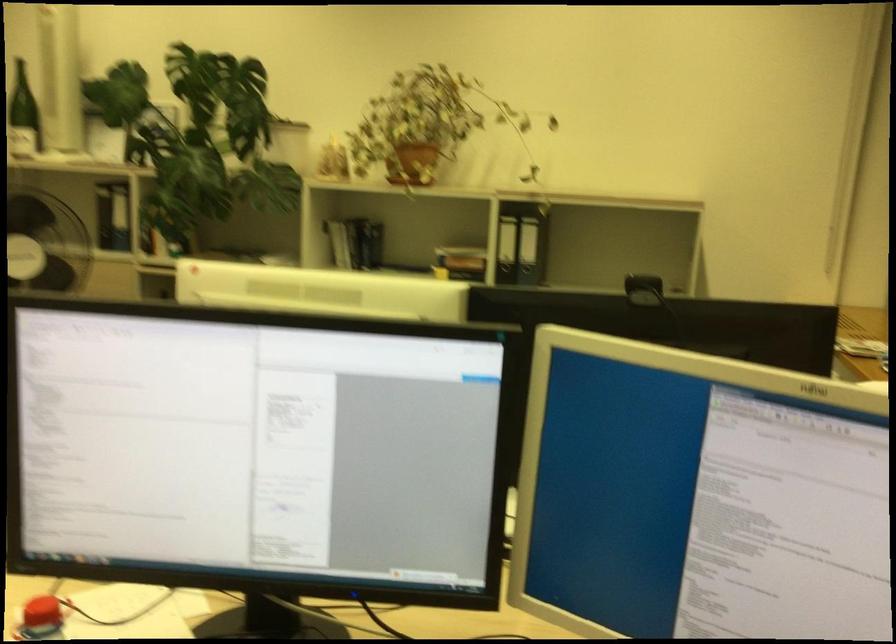
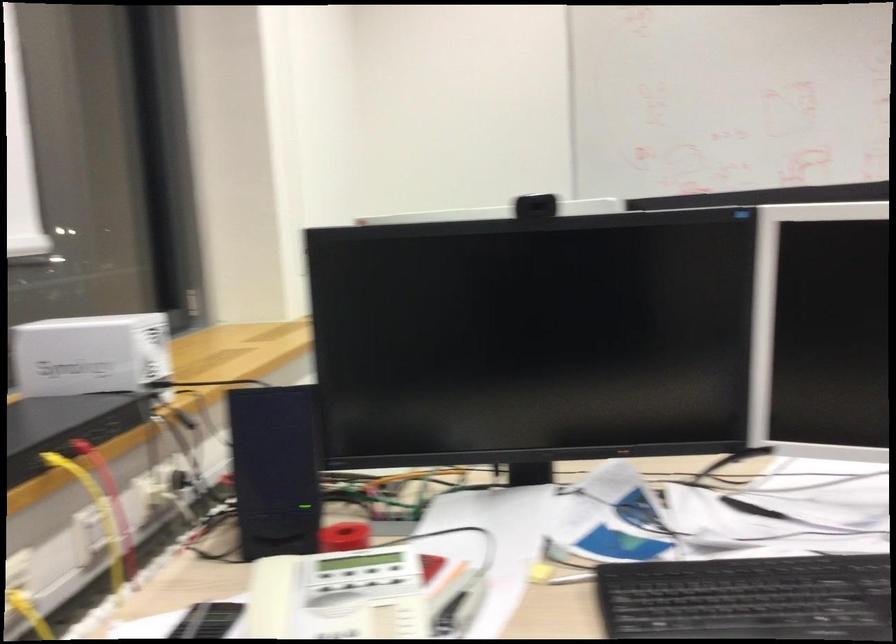
In the second image, find the point that corresponds to [699,301] in the first image.

(536, 205)